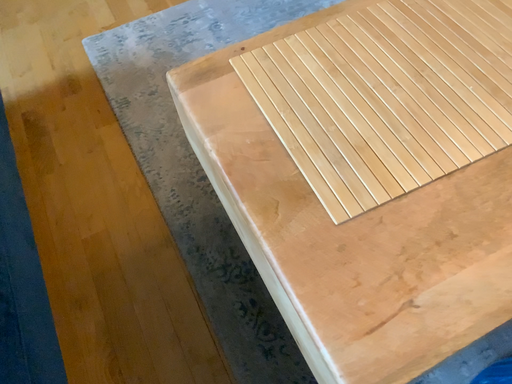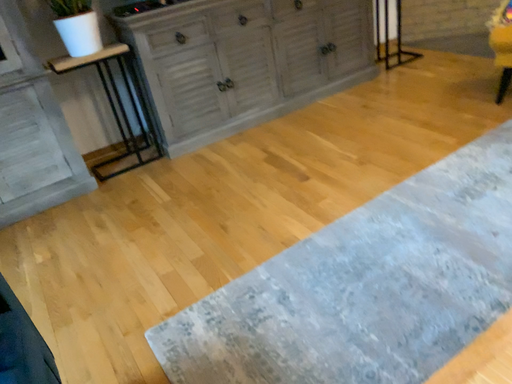
Question: How did the camera likely rotate when shooting the video?

Choices:
 (A) rotated downward
 (B) rotated upward

Answer: (B)